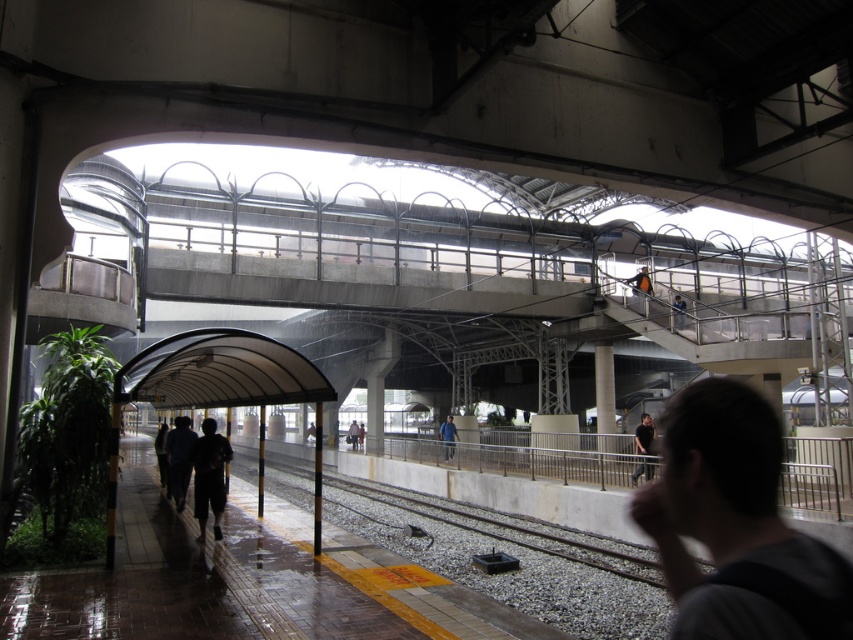
Question: Is dark gray fabric jacket at center to the left of blue fabric jacket at center from the viewer's perspective?

Choices:
 (A) yes
 (B) no

Answer: (B)

Question: Is dark gray pants at center positioned at the back of blue denim jacket at upper center?

Choices:
 (A) no
 (B) yes

Answer: (A)

Question: Estimate the real-world distances between objects in this image. Which object is farther from the blue fabric jacket at center?

Choices:
 (A) blue denim jacket at upper center
 (B) dark gray hoodie at center
 (C) dark gray pants at center

Answer: (B)

Question: Estimate the real-world distances between objects in this image. Which object is farther from the dark gray hoodie at center?

Choices:
 (A) blue fabric jacket at center
 (B) dark gray fabric jacket at center

Answer: (A)

Question: Can you confirm if dark gray hoodie at center is positioned to the left of blue denim jacket at upper center?

Choices:
 (A) no
 (B) yes

Answer: (B)

Question: Which of the following is the closest to the observer?

Choices:
 (A) (643, 448)
 (B) (450, 460)
 (C) (676, 564)

Answer: (C)